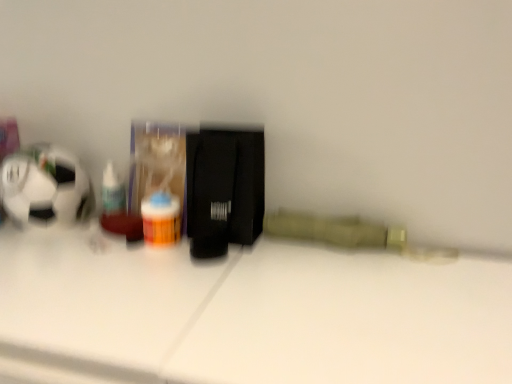
Question: Considering the positions of white glossy table at center and translucent plastic pill bottle at center in the image, is white glossy table at center taller or shorter than translucent plastic pill bottle at center?

Choices:
 (A) short
 (B) tall

Answer: (B)

Question: Considering the positions of point (15, 301) and point (147, 196), is point (15, 301) closer or farther from the camera than point (147, 196)?

Choices:
 (A) farther
 (B) closer

Answer: (B)

Question: Considering the real-world distances, which object is closest to the white glossy table at center?

Choices:
 (A) translucent plastic pill bottle at center
 (B) translucent plastic bottle at left

Answer: (A)

Question: Which of these objects is positioned closest to the translucent plastic bottle at left?

Choices:
 (A) translucent plastic pill bottle at center
 (B) white glossy table at center

Answer: (A)